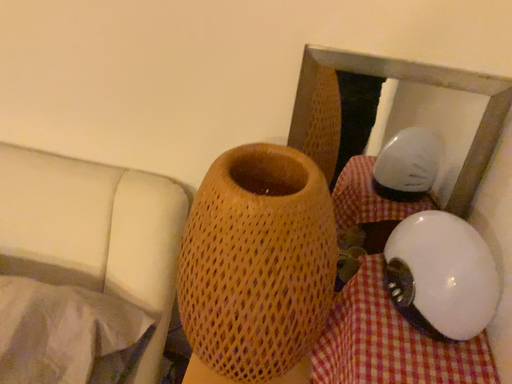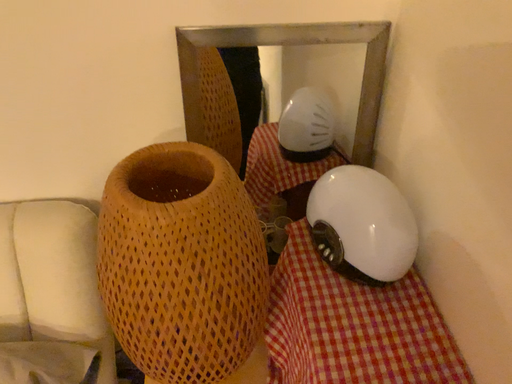
Question: How did the camera likely rotate when shooting the video?

Choices:
 (A) rotated left
 (B) rotated right

Answer: (B)